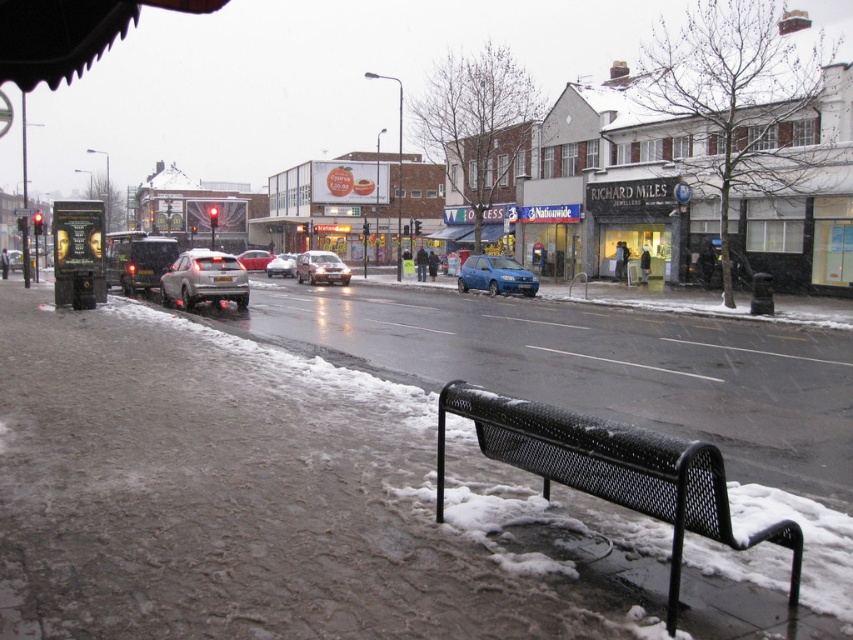
You are a delivery person who needs to park your vehicle in the area shown. The parking spot you want is at coordinates 0.42, 0.38. Is the satin silver sedan at center currently blocking that spot?

The satin silver sedan at center is located at point (321, 268), which is very close to the desired parking spot at (323, 268). Since the coordinates are nearly identical, the sedan is likely blocking the parking spot.

You are a pedestrian standing at the edge of the road and see both the satin silver hatchback at center and the blue metallic hatchback at center. Which car is nearer to you?

The satin silver hatchback at center is closer to the viewer than the blue metallic hatchback at center, so the satin silver hatchback at center is nearer to you.